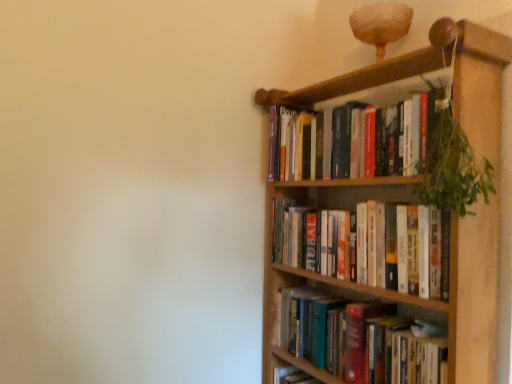
Question: Is wooden bookcase at upper right taller or shorter than hardcover books at upper right, the 3th book in the bottom-to-top sequence?

Choices:
 (A) tall
 (B) short

Answer: (A)

Question: Based on their positions, is wooden bookcase at upper right located to the left or right of hardcover books at upper right, the 3th book in the bottom-to-top sequence?

Choices:
 (A) right
 (B) left

Answer: (A)

Question: Which object is positioned closest to the hardcover books at right, marked as the 1th book in a bottom-to-top arrangement?

Choices:
 (A) wooden bookcase at upper right
 (B) hardcover books at upper right, the 3th book in the bottom-to-top sequence
 (C) hardcover books at upper right, the 2th book positioned from the bottom
 (D) green leafy plant at upper right

Answer: (C)

Question: Based on their relative distances, which object is nearer to the green leafy plant at upper right?

Choices:
 (A) wooden bookcase at upper right
 (B) hardcover books at right, marked as the third book in a top-to-bottom arrangement
 (C) hardcover books at upper right, the 2th book positioned from the bottom
 (D) hardcover books at upper right, which is the 1th book in top-to-bottom order

Answer: (A)